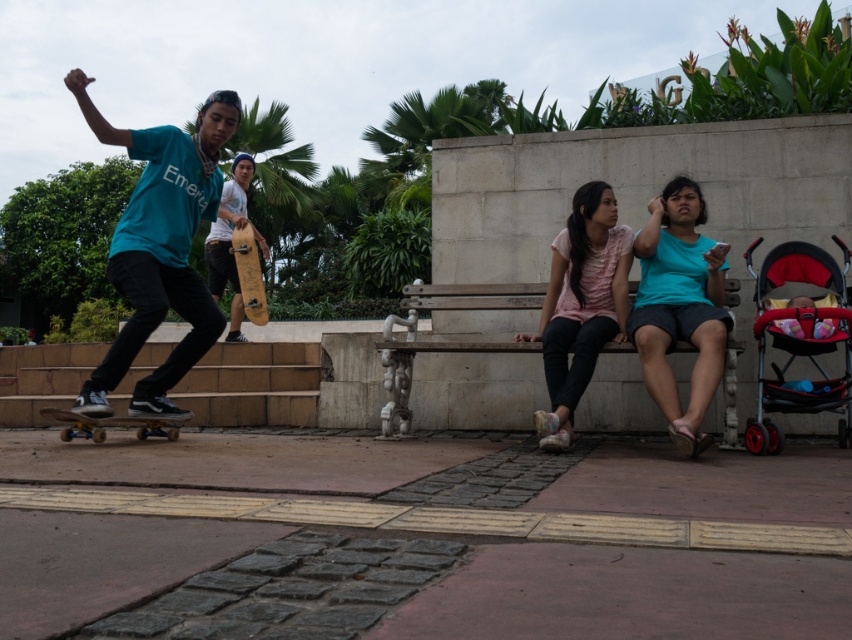
In the scene shown: Can you confirm if teal matte shirt at center is smaller than red plastic baby carriage at lower right?

Actually, teal matte shirt at center might be larger than red plastic baby carriage at lower right.

Does teal matte shirt at center appear on the right side of red plastic baby carriage at lower right?

In fact, teal matte shirt at center is to the left of red plastic baby carriage at lower right.

Is point (688, 209) in front of point (807, 404)?

That is False.

Identify the location of teal matte shirt at center. This screenshot has height=640, width=852. (678, 307).

Does teal matte shirt at left appear over red plastic baby carriage at lower right?

Yes, teal matte shirt at left is above red plastic baby carriage at lower right.

Can you confirm if teal matte shirt at left is positioned below red plastic baby carriage at lower right?

No.

Where is `teal matte shirt at left`? The width and height of the screenshot is (852, 640). teal matte shirt at left is located at coordinates (159, 248).

Based on the photo, is red plastic baby carriage at lower right shorter than wooden skateboard at lower left?

No.

Can you confirm if red plastic baby carriage at lower right is smaller than wooden skateboard at lower left?

Incorrect, red plastic baby carriage at lower right is not smaller in size than wooden skateboard at lower left.

Who is more distant from viewer, (802,339) or (89,433)?

The point (89,433) is behind.

This screenshot has width=852, height=640. In order to click on red plastic baby carriage at lower right in this screenshot , I will do `click(799, 339)`.